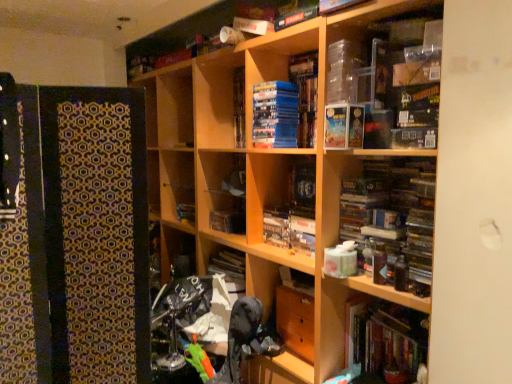
Question: Is patterned fabric at left outside blue matte stack of books at center, which ranks as the 2th paperback book in right-to-left order?

Choices:
 (A) yes
 (B) no

Answer: (A)

Question: From a real-world perspective, does patterned fabric at left sit lower than blue matte stack of books at center, which ranks as the 2th paperback book in right-to-left order?

Choices:
 (A) no
 (B) yes

Answer: (B)

Question: Can you confirm if patterned fabric at left is bigger than blue matte stack of books at center, which appears as the first paperback book when viewed from the left?

Choices:
 (A) no
 (B) yes

Answer: (B)

Question: Is patterned fabric at left taller than blue matte stack of books at center, the first paperback book positioned from the back?

Choices:
 (A) yes
 (B) no

Answer: (A)

Question: Does patterned fabric at left have a lesser height compared to blue matte stack of books at center, which ranks as the 2th paperback book in right-to-left order?

Choices:
 (A) yes
 (B) no

Answer: (B)

Question: Considering the positions of wooden bookcase at center and hardcover book at center, the 2th book in the bottom-to-top sequence, in the image, is wooden bookcase at center bigger or smaller than hardcover book at center, the 2th book in the bottom-to-top sequence,?

Choices:
 (A) big
 (B) small

Answer: (A)

Question: Which is correct: wooden bookcase at center is inside hardcover book at center, the 1th book positioned from the back, or outside of it?

Choices:
 (A) outside
 (B) inside

Answer: (A)

Question: In terms of width, does wooden bookcase at center look wider or thinner when compared to hardcover book at center, the 1th book positioned from the back?

Choices:
 (A) thin
 (B) wide

Answer: (B)

Question: From a real-world perspective, is wooden bookcase at center positioned above or below hardcover book at center, the 1th book positioned from the back?

Choices:
 (A) above
 (B) below

Answer: (B)

Question: Is patterned fabric at left taller or shorter than wooden bookcase at center?

Choices:
 (A) short
 (B) tall

Answer: (A)

Question: From a real-world perspective, relative to wooden bookcase at center, is patterned fabric at left vertically above or below?

Choices:
 (A) below
 (B) above

Answer: (B)

Question: In the image, is patterned fabric at left on the left side or the right side of wooden bookcase at center?

Choices:
 (A) right
 (B) left

Answer: (B)

Question: In the image, is patterned fabric at left positioned in front of or behind wooden bookcase at center?

Choices:
 (A) behind
 (B) front

Answer: (A)

Question: From a real-world perspective, is hardcover book at center, which is counted as the 2th paperback book, starting from the left, physically located above or below blue matte stack of books at center, the first paperback book positioned from the back?

Choices:
 (A) above
 (B) below

Answer: (B)

Question: Relative to blue matte stack of books at center, which appears as the first paperback book when viewed from the left, is hardcover book at center, marked as the first paperback book in a front-to-back arrangement, in front or behind?

Choices:
 (A) front
 (B) behind

Answer: (A)